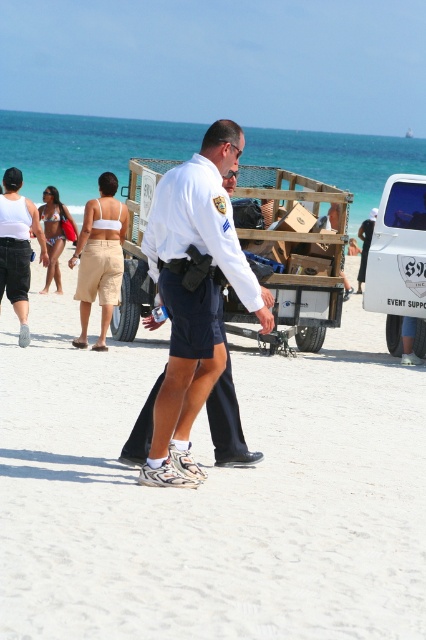
Question: Observing the image, what is the correct spatial positioning of wooden cart at center in reference to white matte van at right?

Choices:
 (A) above
 (B) below

Answer: (A)

Question: Which of these objects is positioned farthest from the white uniform at center?

Choices:
 (A) white matte van at right
 (B) wooden cart at center
 (C) white matte uniform at center

Answer: (A)

Question: Which of the following is the farthest from the observer?

Choices:
 (A) (293, 362)
 (B) (233, 138)
 (C) (284, 243)

Answer: (C)

Question: Considering the relative positions of white matte uniform at center and white uniform at center in the image provided, where is white matte uniform at center located with respect to white uniform at center?

Choices:
 (A) below
 (B) above

Answer: (A)

Question: Which point is closer to the camera?

Choices:
 (A) wooden cart at center
 (B) white matte van at right
 (C) white matte uniform at center

Answer: (C)

Question: Does white matte uniform at center appear over white uniform at center?

Choices:
 (A) no
 (B) yes

Answer: (A)